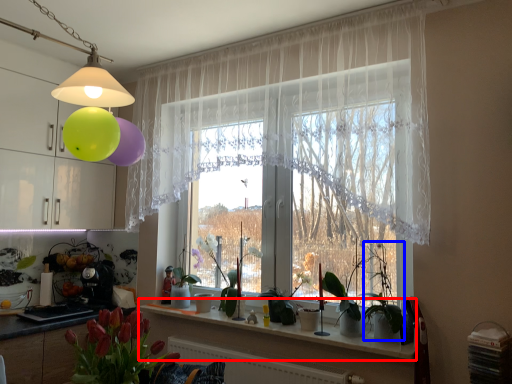
Question: Which of the following is the closest to the observer, window sill (highlighted by a red box) or plant (highlighted by a blue box)?

Choices:
 (A) window sill
 (B) plant

Answer: (B)